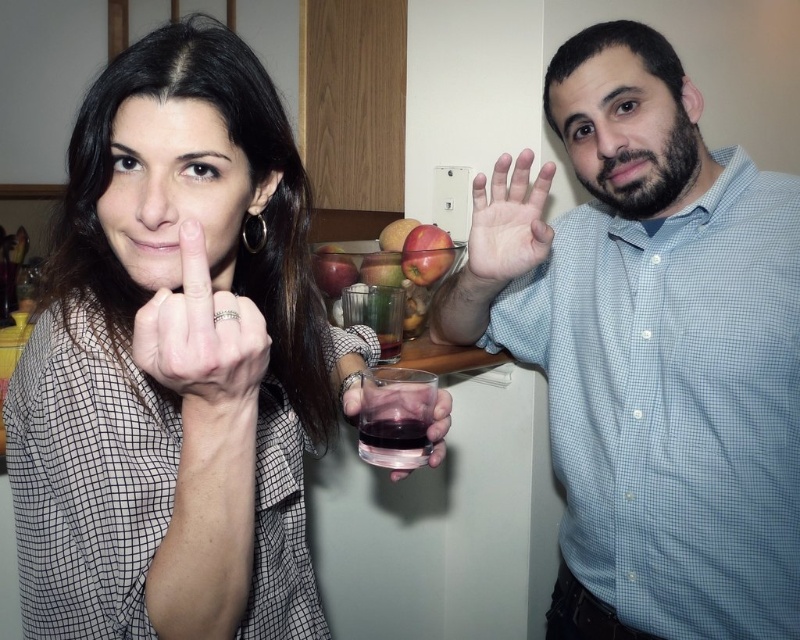
Question: Which point is closer to the camera?

Choices:
 (A) glossy apple at center
 (B) red matte apple at center
 (C) matte black shirt at left

Answer: (C)

Question: Is silver metallic ring at upper center further to the viewer compared to translucent glass at center?

Choices:
 (A) yes
 (B) no

Answer: (B)

Question: Is light blue checkered shirt at right positioned before silver metallic ring at upper center?

Choices:
 (A) no
 (B) yes

Answer: (A)

Question: Among these objects, which one is farthest from the camera?

Choices:
 (A) red matte apple at center
 (B) matte black shirt at left

Answer: (A)

Question: Is matte skin palm at center closer to camera compared to glossy apple at center?

Choices:
 (A) no
 (B) yes

Answer: (B)

Question: Estimate the real-world distances between objects in this image. Which object is closer to the silver metallic ring at upper center?

Choices:
 (A) red matte apple at center
 (B) translucent glass at center
 (C) transparent plastic wine glass at center

Answer: (C)